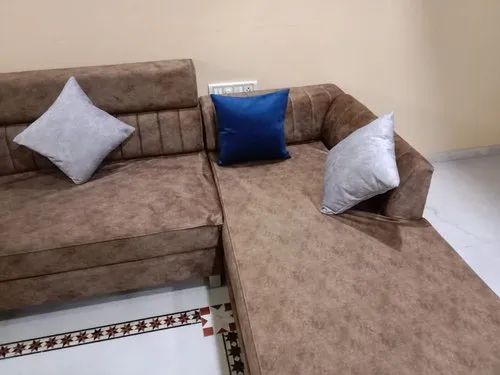
Where is `beige wall behind couch`? beige wall behind couch is located at coordinates (235, 30).